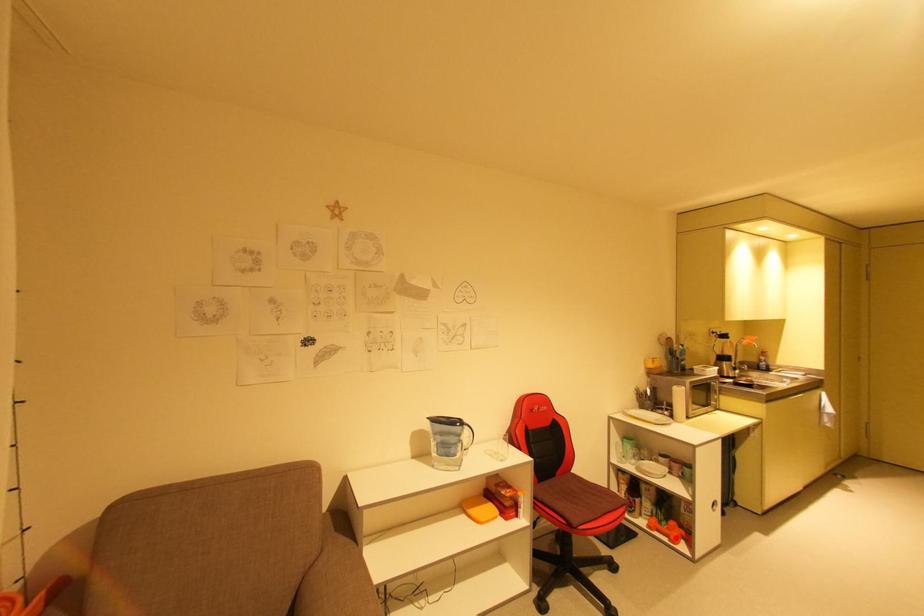
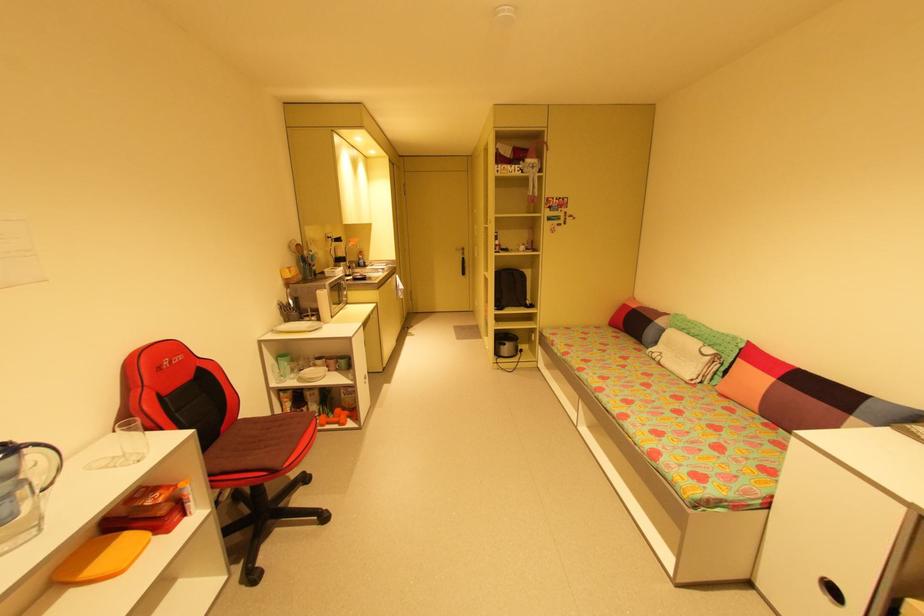
Locate, in the second image, the point that corresponds to the highlighted location in the first image.

(345, 422)